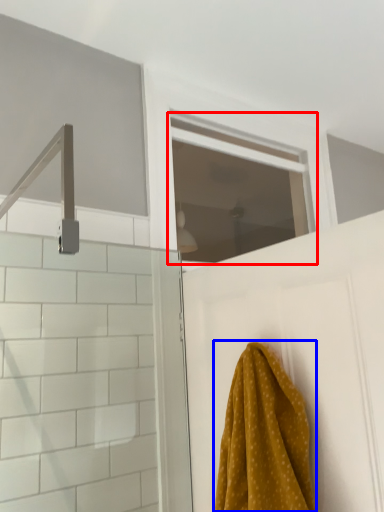
Question: Which point is closer to the camera, window (highlighted by a red box) or towel (highlighted by a blue box)?

Choices:
 (A) window
 (B) towel

Answer: (B)